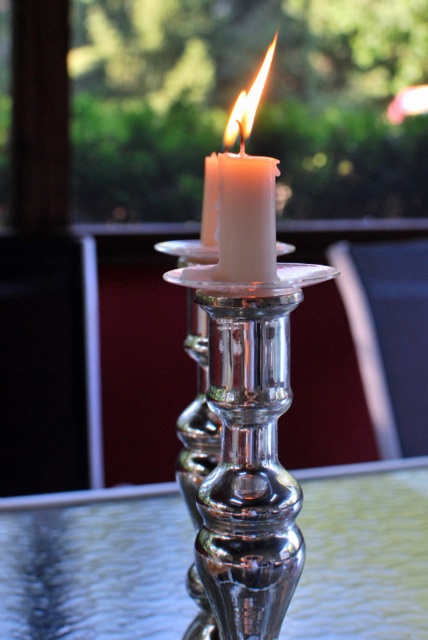
You are standing in front of the glass table and want to place a small vase exactly at the point marked as point (x=95, y=570). Based on the scene description, where would this point be located?

The point (x=95, y=570) corresponds to the silver metallic table at center, so placing the vase there would put it on the silver metallic table at center.

You are a decorator arranging items on a table. You have a silver metallic table at center and a white wax candle at center. Which object is taller?

The white wax candle at center is taller than the silver metallic table at center.

You are a photographer trying to capture the bright yellow flame at center and the white wax candle at center in one shot. Which object should you adjust your camera focus on first to ensure both are in focus?

The bright yellow flame at center is to the right of white wax candle at center, so you should focus on the white wax candle at center first as it is closer to the camera, ensuring both are in focus.